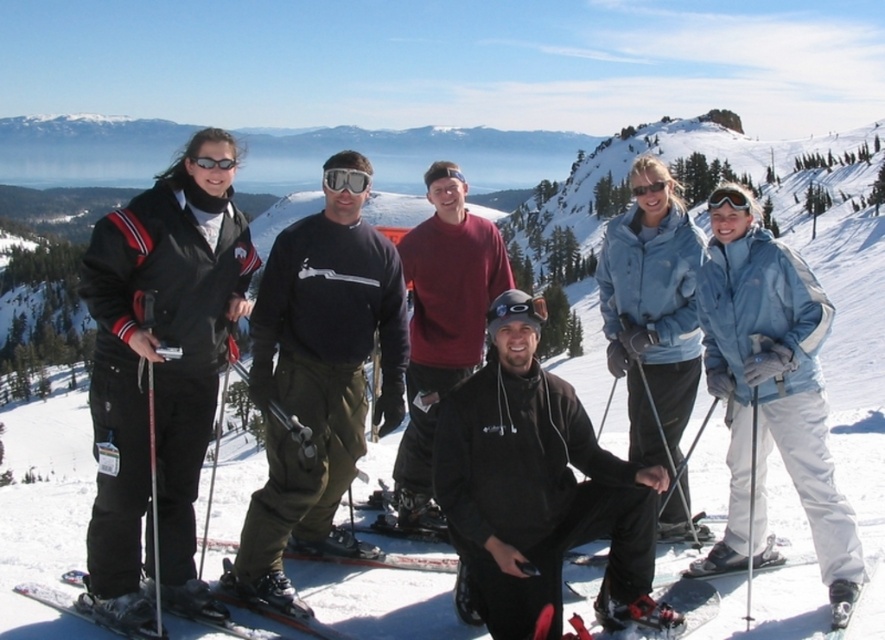
Based on the photo, you are a photographer trying to capture a clear photo of the red plastic ski at lower center. However, the black matte jacket at center is blocking your view. Can you determine if the jacket is in front of or behind the ski?

The black matte jacket at center is positioned over red plastic ski at lower center, meaning the jacket is in front of the ski. To get a clear photo of the ski, you would need to move around the jacket to ensure it is no longer blocking your view.